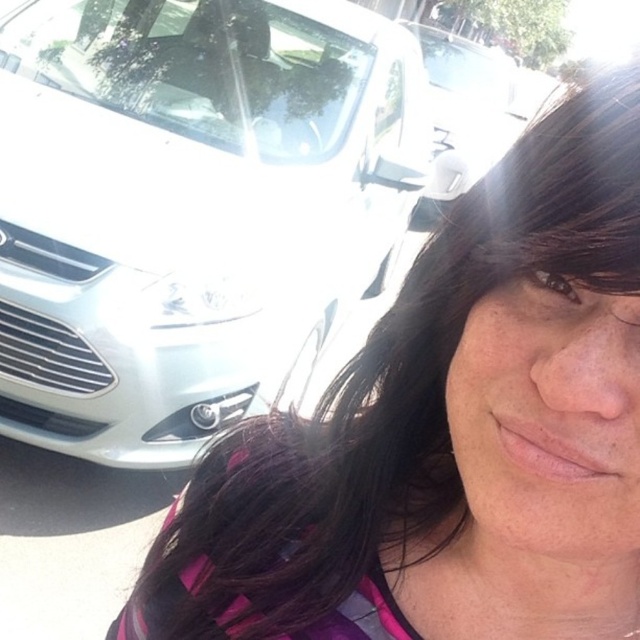
You are a photographer setting up a shoot in the scene. You need to position a light source between the white glossy car at left and the white glossy car at upper left. Which car should the light be closer to if you want it to be nearer to the shorter car?

The white glossy car at left is shorter than the white glossy car at upper left. Therefore, the light source should be placed closer to the white glossy car at left to ensure it is nearer to the shorter car.

You are a photographer setting up a shot of the person wearing a pink top. You notice two white glossy cars in the background. Which car, the white glossy car at left or the white glossy car at upper left, is closer to the center of the image?

The white glossy car at left is closer to the center of the image because it is positioned on the left side of the white glossy car at upper left, meaning it is nearer to the central area compared to the one at upper left.

Consider the image. You are standing in front of the scene and see two points marked on the image. Which point, point (99, 74) or point (458, 104), is closer to you?

A: Point (99, 74) is closer to the viewer than point (458, 104).